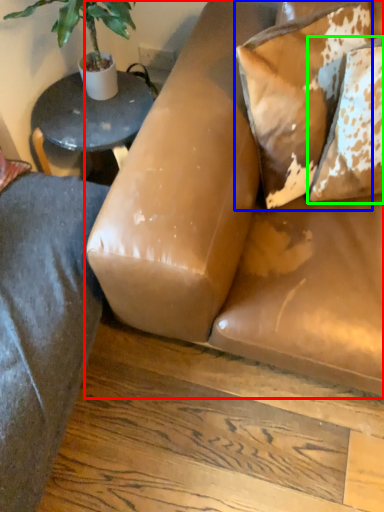
Question: Which is nearer to the studio couch (highlighted by a red box)? pillow (highlighted by a blue box) or pillow (highlighted by a green box).

Choices:
 (A) pillow
 (B) pillow

Answer: (A)